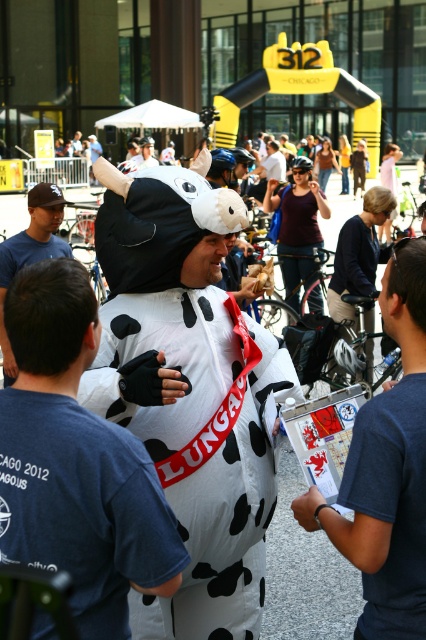
Question: Is dark blue t-shirt at left smaller than white plush cow at center?

Choices:
 (A) no
 (B) yes

Answer: (B)

Question: Considering the relative positions of white matte cow at center and white paper map at center in the image provided, where is white matte cow at center located with respect to white paper map at center?

Choices:
 (A) left
 (B) right

Answer: (A)

Question: Which object appears farthest from the camera in this image?

Choices:
 (A) white plush cow at center
 (B) white paper map at center

Answer: (A)

Question: Which of these objects is positioned closest to the white matte cow at center?

Choices:
 (A) white paper map at center
 (B) dark blue t-shirt at left

Answer: (A)

Question: Which point is farther from the camera taking this photo?

Choices:
 (A) (354, 440)
 (B) (34, 252)
 (C) (120, 620)

Answer: (B)

Question: Is white matte cow at center wider than dark blue t-shirt at left?

Choices:
 (A) no
 (B) yes

Answer: (A)